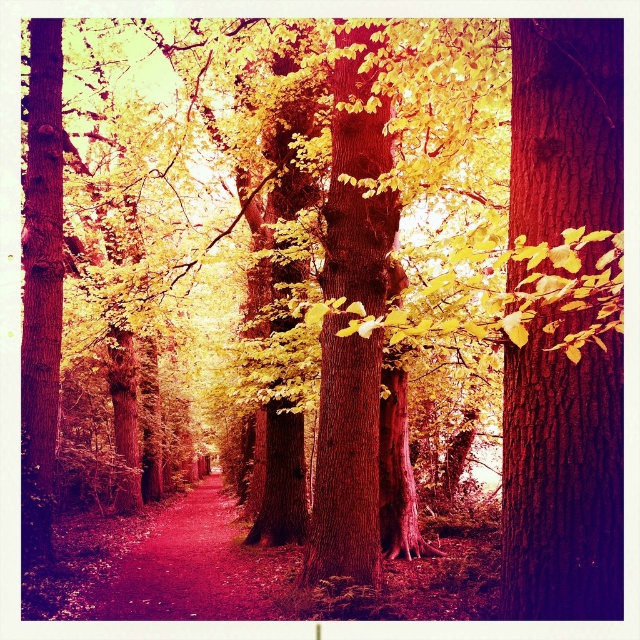
You are standing on the smooth dirt path at center and want to reach a cabin located behind the smooth bark tree at right. Can you walk around the tree to get to the cabin?

The smooth bark tree at right is in front of the smooth dirt path at center, so you cannot directly walk around it to reach the cabin behind. You might need to find another path or go around the tree from another direction.